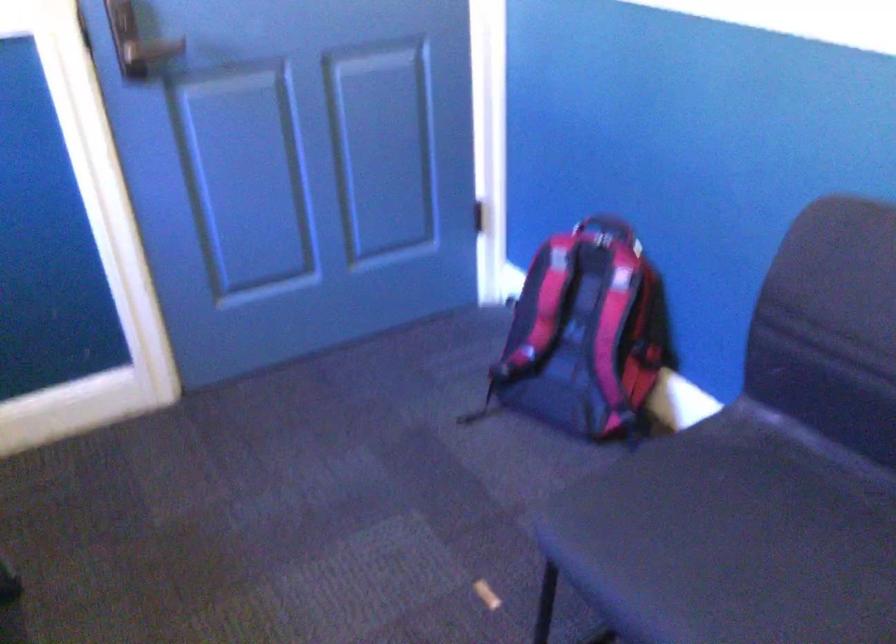
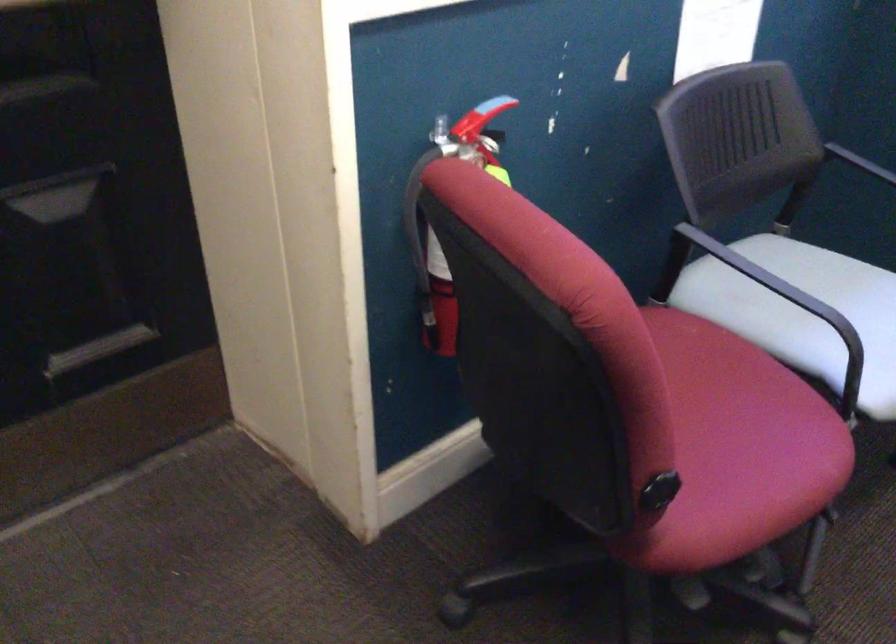
First-person continuous shooting, in which direction is the camera rotating?

The rotation direction of the camera is left-down.